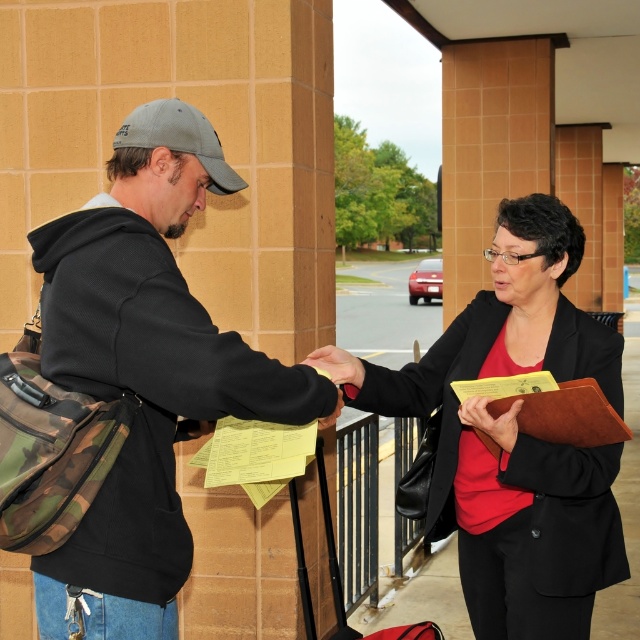
Can you confirm if camo fabric bag at left is smaller than matte black blazer at center?

Indeed, camo fabric bag at left has a smaller size compared to matte black blazer at center.

In the scene shown: Which is below, camo fabric bag at left or matte black blazer at center?

matte black blazer at center is lower down.

Does point (76, 344) come farther from viewer compared to point (515, 202)?

No, it is in front of (515, 202).

Where is `camo fabric bag at left`? camo fabric bag at left is located at coordinates (147, 365).